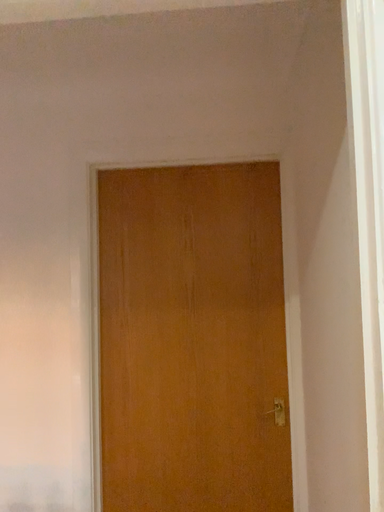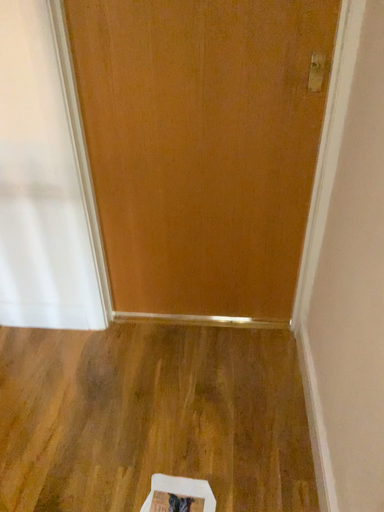
Question: Which way did the camera rotate in the video?

Choices:
 (A) rotated downward
 (B) rotated upward

Answer: (A)